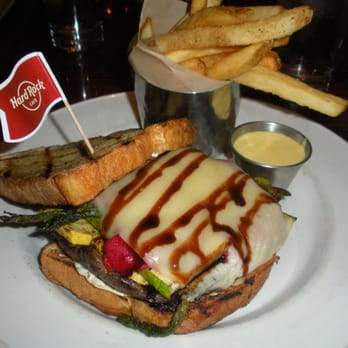
Identify the location of silver condiment cup. (286, 176).